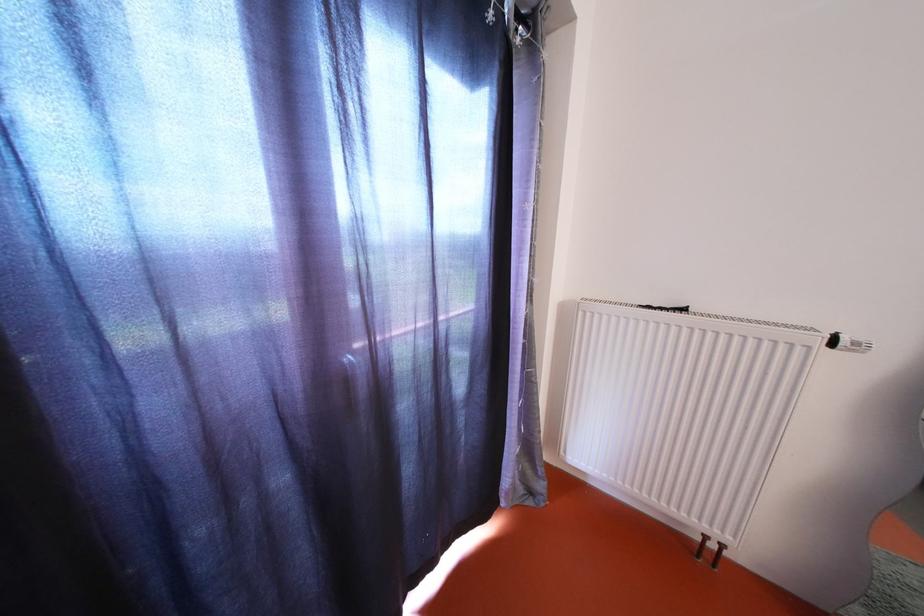
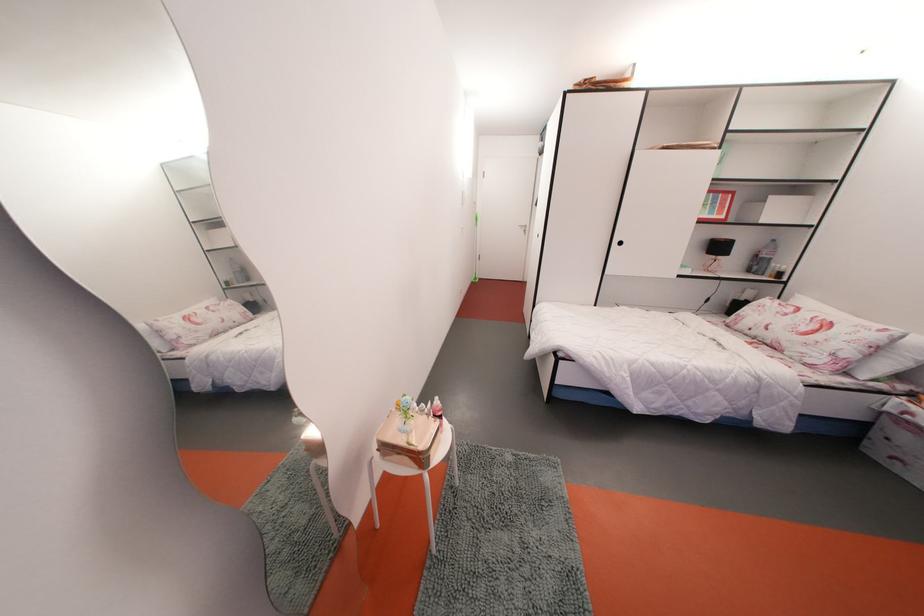
Based on the continuous images, in which direction is the camera rotating?

The rotation direction of the camera is right-down.